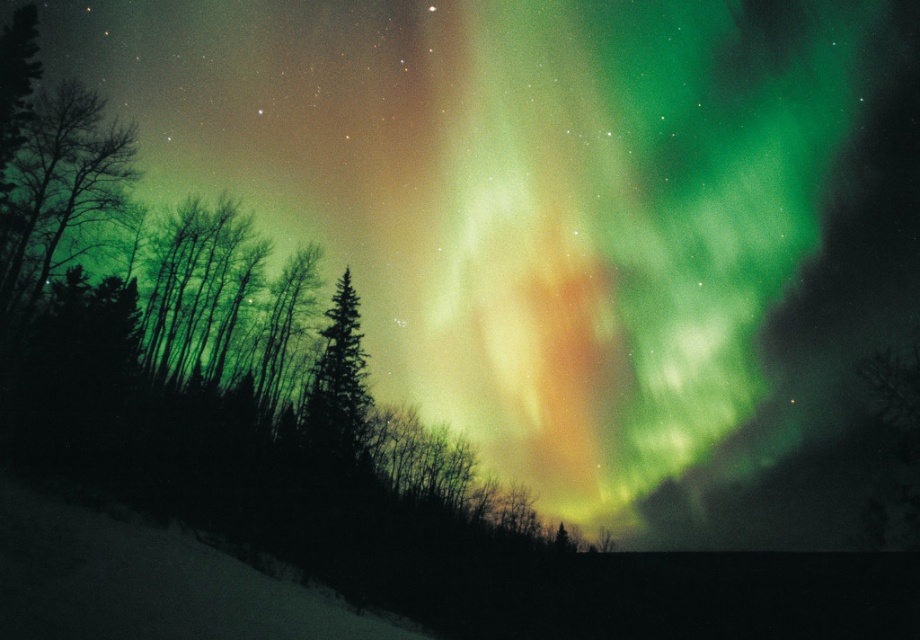
Question: Which object appears closest to the camera in this image?

Choices:
 (A) green matte tree at left
 (B) green matte tree at center

Answer: (A)

Question: Does green matte tree at left have a smaller size compared to green matte tree at center?

Choices:
 (A) no
 (B) yes

Answer: (B)

Question: Is green matte tree at left below green matte tree at center?

Choices:
 (A) no
 (B) yes

Answer: (A)

Question: Where is green matte tree at left located in relation to green matte tree at center in the image?

Choices:
 (A) left
 (B) right

Answer: (A)

Question: Which object is farther from the camera taking this photo?

Choices:
 (A) green matte tree at left
 (B) green matte tree at center

Answer: (B)